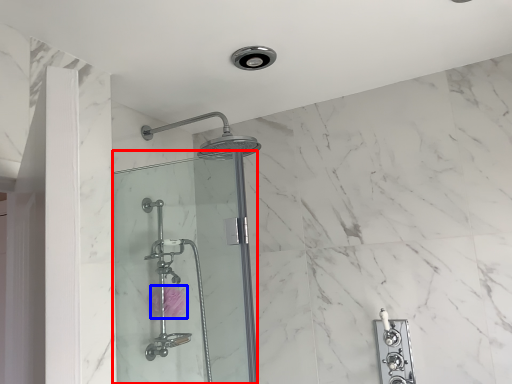
Question: Which point is further to the camera, shower door (highlighted by a red box) or flower (highlighted by a blue box)?

Choices:
 (A) shower door
 (B) flower

Answer: (B)